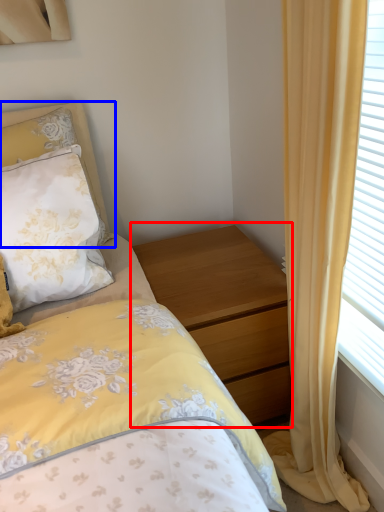
Question: Which of the following is the farthest to the observer, nightstand (highlighted by a red box) or pillow (highlighted by a blue box)?

Choices:
 (A) nightstand
 (B) pillow

Answer: (A)